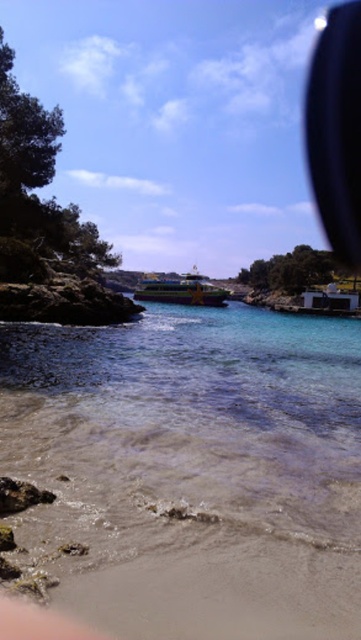
Can you confirm if clear water at center is bigger than green plastic boat at center?

Actually, clear water at center might be smaller than green plastic boat at center.

Does clear water at center appear over green plastic boat at center?

No.

Between point (310, 364) and point (154, 298), which one is positioned behind?

Point (154, 298)

This screenshot has width=361, height=640. Find the location of `clear water at center`. clear water at center is located at coordinates (190, 472).

Does clear water at center appear on the left side of black glossy view mirror at upper right?

Indeed, clear water at center is positioned on the left side of black glossy view mirror at upper right.

In the scene shown: Who is positioned more to the left, clear water at center or black glossy view mirror at upper right?

clear water at center is more to the left.

Is point (87, 515) closer to viewer compared to point (332, 60)?

Yes.

The width and height of the screenshot is (361, 640). In order to click on clear water at center in this screenshot , I will do (190, 472).

Is black glossy view mirror at upper right closer to camera compared to green plastic boat at center?

No.

Does point (337, 40) come behind point (224, 294)?

Yes.

Between point (314, 150) and point (185, 276), which one is positioned behind?

The point (314, 150) is behind.

I want to click on black glossy view mirror at upper right, so click(336, 129).